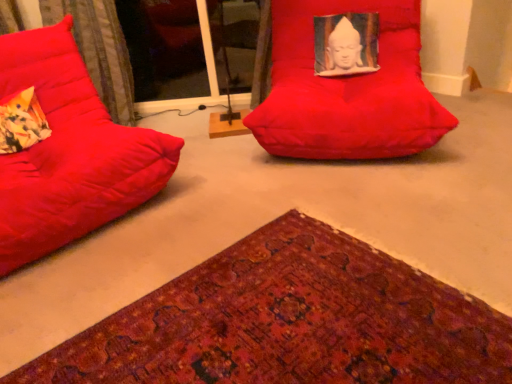
This screenshot has height=384, width=512. What are the coordinates of `vacant region below textured woolen mat at lower left (from a real-world perspective)` in the screenshot? It's located at (289, 306).